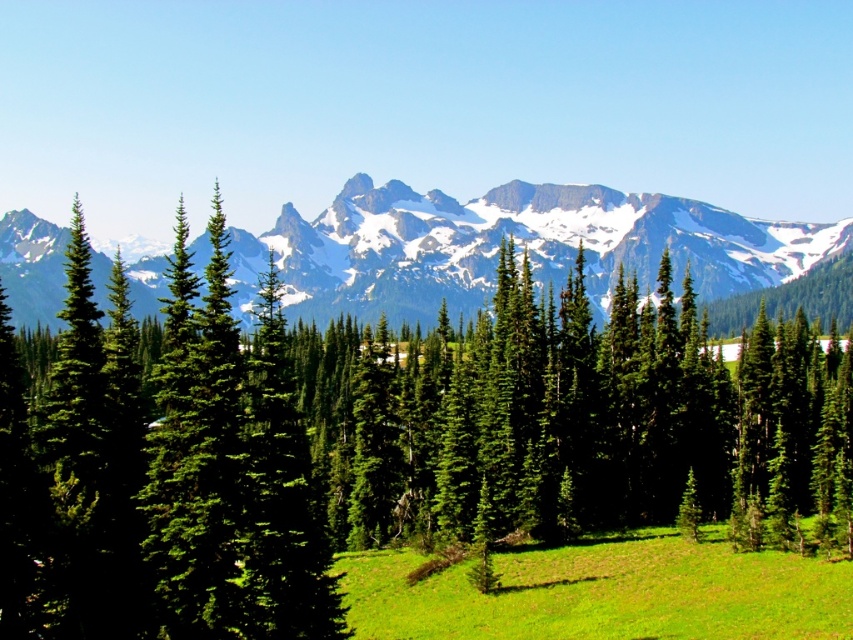
In the scene shown: You are standing in the middle of the green grassy field at center and want to walk towards the green matte tree at center. In which direction should you head?

You should head to the left because the green matte tree at center is located to the left of the green grassy field at center.

Looking at this image, you are standing in the meadow and see two points in the scene. The first point is at coordinates point (79,474) and the second is at point (717,568). Which point is nearer to you?

Point (79,474) is closer to the camera than point (717,568), so the first point is nearer to you.

You are standing in the meadow and want to determine which tree is taller between the green matte tree at center and the green matte evergreen tree at center. Which one is taller?

The green matte evergreen tree at center is taller than the green matte tree at center.